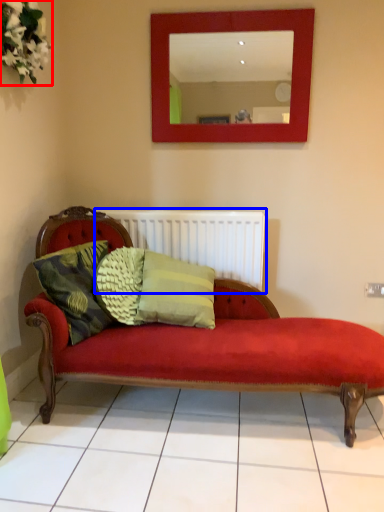
Question: Which object is further to the camera taking this photo, floral arrangement (highlighted by a red box) or radiator (highlighted by a blue box)?

Choices:
 (A) floral arrangement
 (B) radiator

Answer: (B)